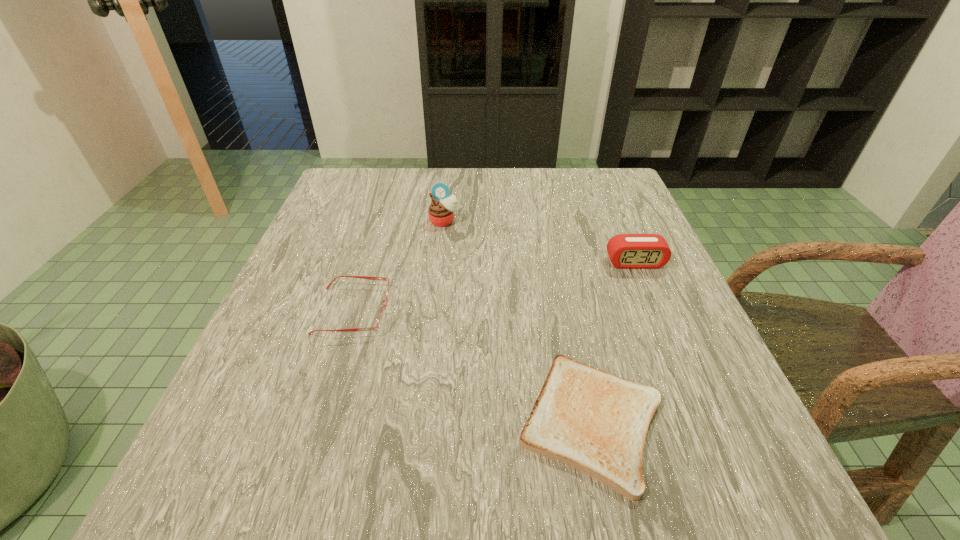
Identify the location of vacant area that lies between the third shortest object and the shortest object. The width and height of the screenshot is (960, 540). (613, 342).

Find the location of a particular element. vacant space that's between the second nearest object and the shortest object is located at coordinates (472, 366).

Identify the location of free space between the alarm clock and the shortest object. The width and height of the screenshot is (960, 540). (613, 342).

In order to click on vacant space that's between the farthest object and the toast in this screenshot , I will do `click(517, 321)`.

The width and height of the screenshot is (960, 540). In order to click on empty location between the second farthest object and the toast in this screenshot , I will do `click(613, 342)`.

Point out which object is positioned as the third nearest to the second object from left to right. Please provide its 2D coordinates. Your answer should be formatted as a tuple, i.e. [(x, y)], where the tuple contains the x and y coordinates of a point satisfying the conditions above.

[(586, 418)]

Locate which object ranks in proximity to the second object from left to right. Please provide its 2D coordinates. Your answer should be formatted as a tuple, i.e. [(x, y)], where the tuple contains the x and y coordinates of a point satisfying the conditions above.

[(381, 318)]

You are a GUI agent. You are given a task and a screenshot of the screen. Output one action in this format:
    pyautogui.click(x=<x>, y=<y>)
    Task: Click on the vacant area in the image that satisfies the following two spatial constraints: 1. on the front-facing side of the third object from right to left; 2. on the lenses of the third tallest object
    
    Given the screenshot: What is the action you would take?
    pyautogui.click(x=434, y=310)

Find the location of a particular element. vacant area in the image that satisfies the following two spatial constraints: 1. on the lenses of the third farthest object; 2. on the right side of the nearest object is located at coordinates (320, 421).

Image resolution: width=960 pixels, height=540 pixels. I want to click on vacant space that satisfies the following two spatial constraints: 1. on the front-facing side of the muffin; 2. on the lenses of the leftmost object, so coord(434,310).